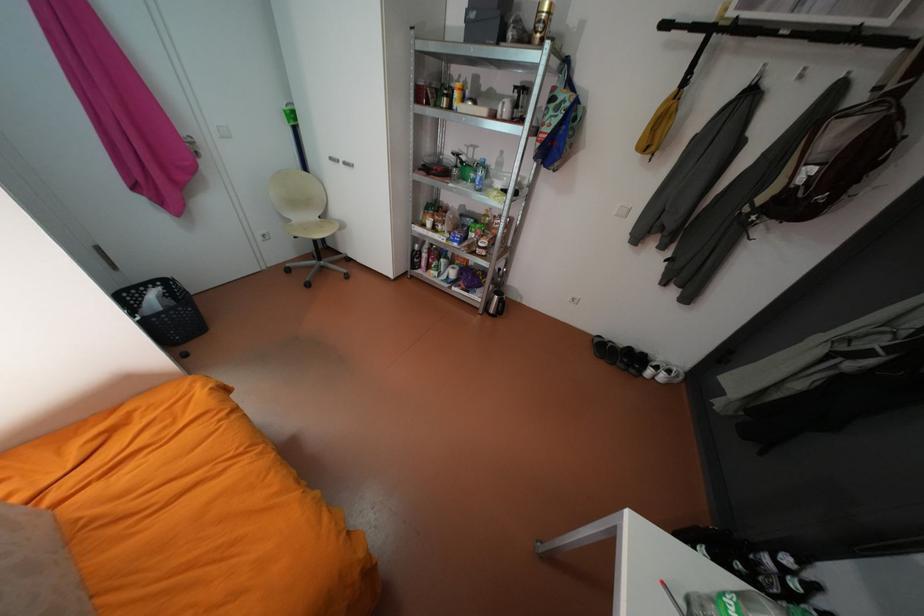
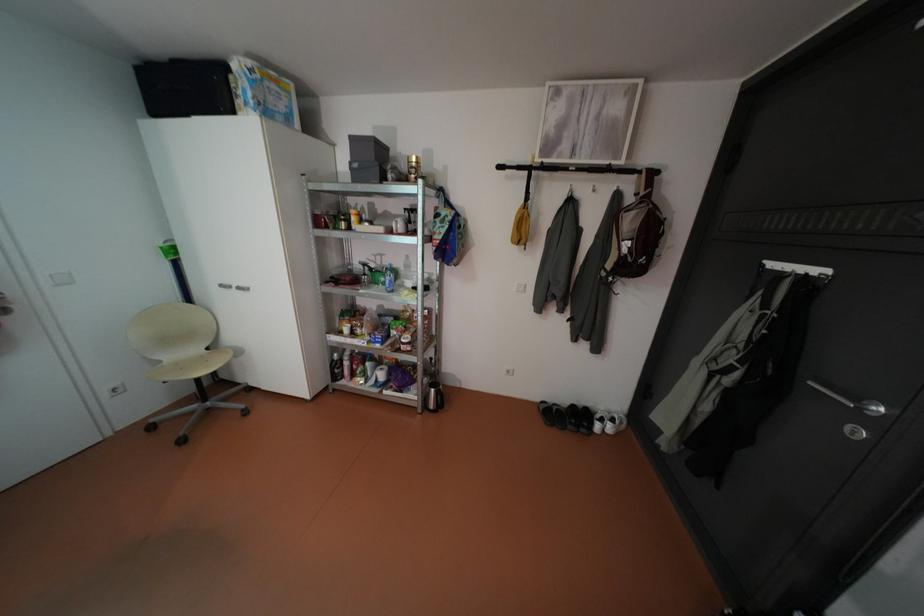
Where in the second image is the point corresponding to [471,177] from the first image?

(383, 282)